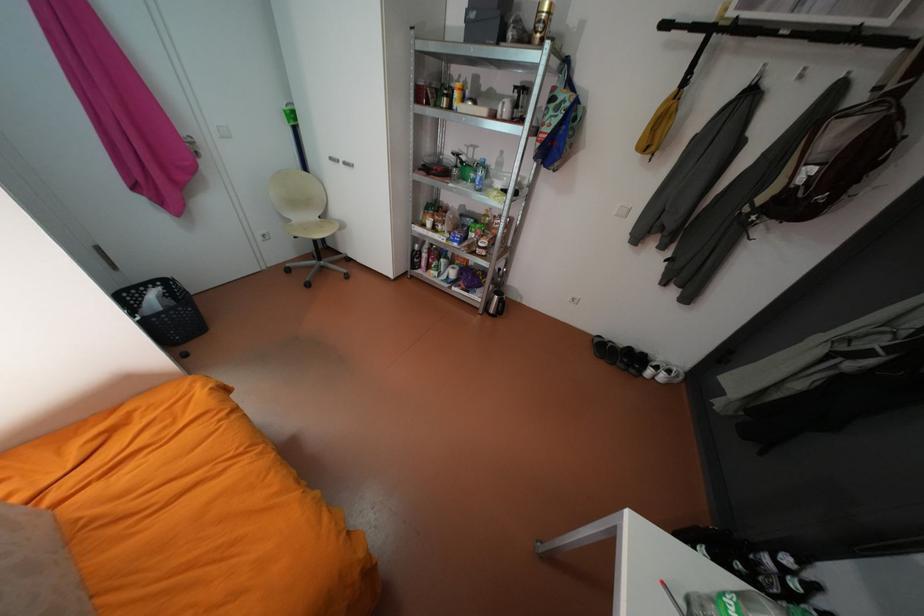
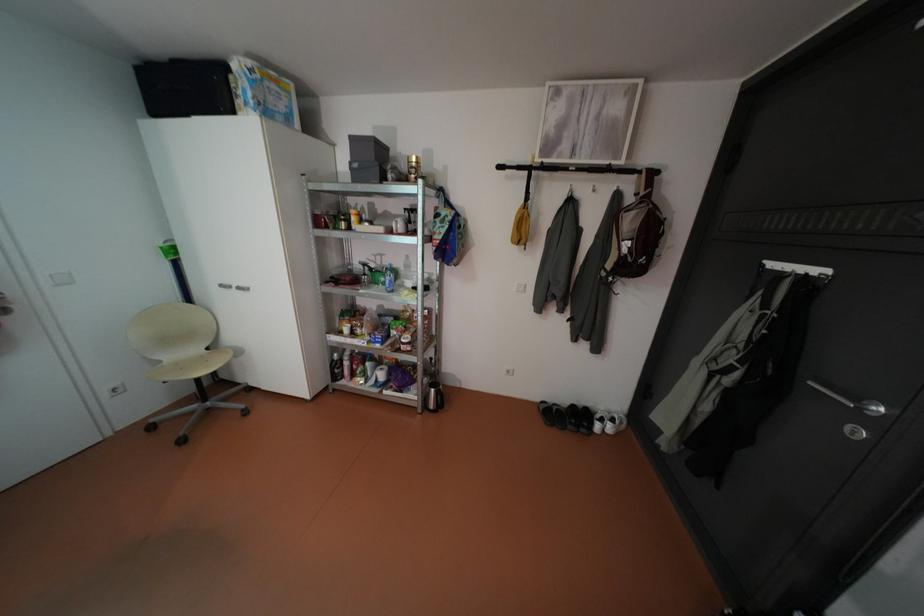
Where in the second image is the point corresponding to [471,177] from the first image?

(383, 282)